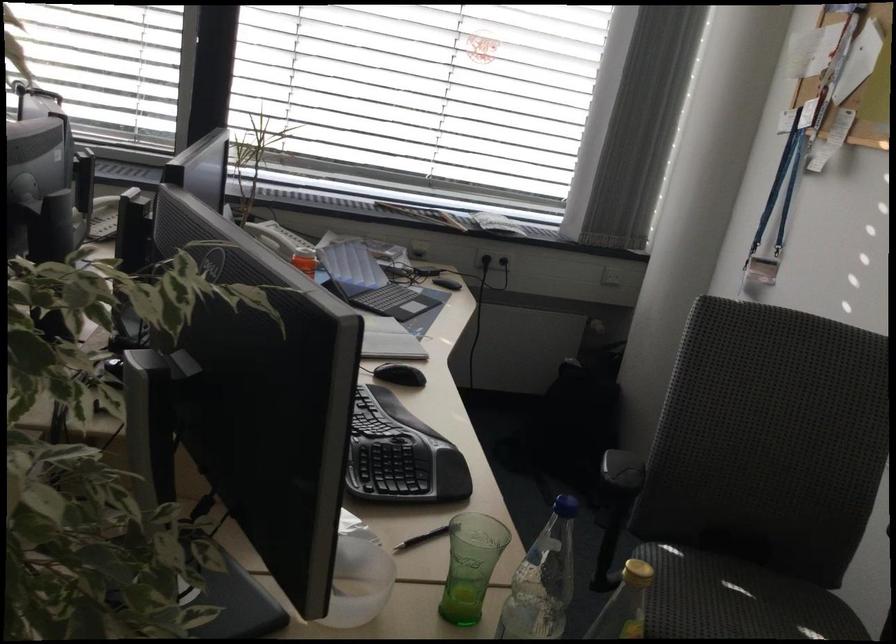
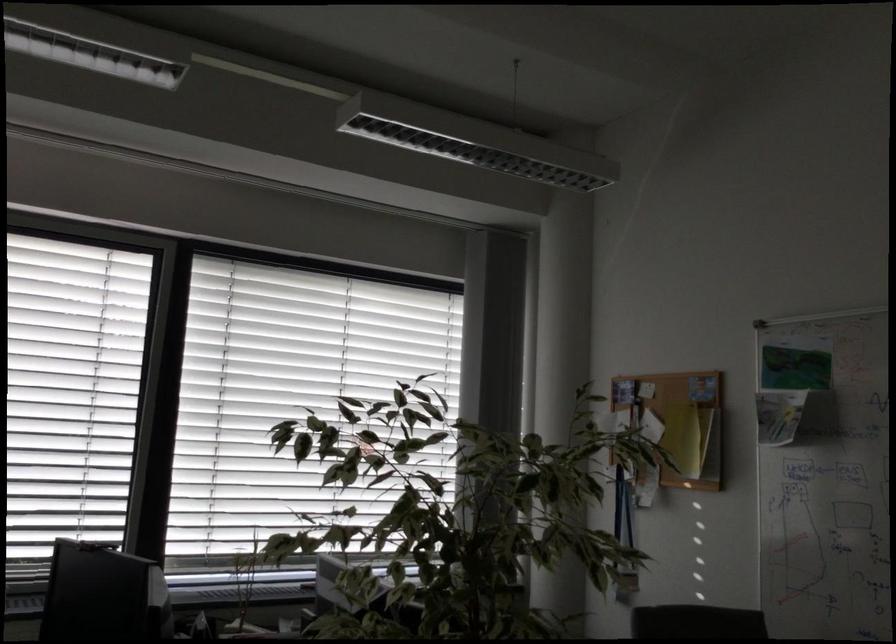
Find the pixel in the second image that matches (786,176) in the first image.

(623, 509)